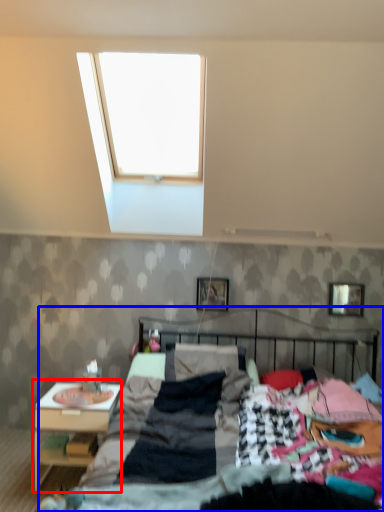
Question: Which object is closer to the camera taking this photo, nightstand (highlighted by a red box) or bed (highlighted by a blue box)?

Choices:
 (A) nightstand
 (B) bed

Answer: (B)